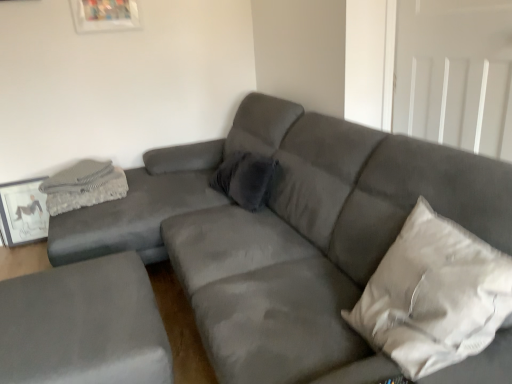
Question: Can velvet gray pillow at center, which is the second pillow in right-to-left order, be found inside white fabric pillow at right, the first pillow when ordered from right to left?

Choices:
 (A) no
 (B) yes

Answer: (A)

Question: Is white fabric pillow at right, the 1th pillow from the front, positioned in front of velvet gray pillow at center, the first pillow from the left?

Choices:
 (A) yes
 (B) no

Answer: (A)

Question: Does white fabric pillow at right, the second pillow positioned from the back, have a lesser width compared to velvet gray pillow at center, positioned as the second pillow in front-to-back order?

Choices:
 (A) no
 (B) yes

Answer: (A)

Question: Is white fabric pillow at right, the second pillow positioned from the back, positioned far away from velvet gray pillow at center, the first pillow from the left?

Choices:
 (A) yes
 (B) no

Answer: (A)

Question: Is white fabric pillow at right, the 1th pillow from the front, to the left of velvet gray pillow at center, which is the second pillow in right-to-left order, from the viewer's perspective?

Choices:
 (A) no
 (B) yes

Answer: (A)

Question: From the image's perspective, is white fabric pillow at right, the first pillow when ordered from right to left, on top of velvet gray pillow at center, the first pillow in the back-to-front sequence?

Choices:
 (A) no
 (B) yes

Answer: (A)

Question: Considering the relative sizes of gray textured blanket at upper left and matte gray picture frame at left in the image provided, is gray textured blanket at upper left wider than matte gray picture frame at left?

Choices:
 (A) no
 (B) yes

Answer: (B)

Question: Is gray textured blanket at upper left oriented away from matte gray picture frame at left?

Choices:
 (A) no
 (B) yes

Answer: (A)

Question: Considering the relative sizes of gray textured blanket at upper left and matte gray picture frame at left in the image provided, is gray textured blanket at upper left bigger than matte gray picture frame at left?

Choices:
 (A) no
 (B) yes

Answer: (B)

Question: Considering the relative sizes of gray textured blanket at upper left and matte gray picture frame at left in the image provided, is gray textured blanket at upper left thinner than matte gray picture frame at left?

Choices:
 (A) no
 (B) yes

Answer: (A)

Question: Is the depth of gray textured blanket at upper left less than that of matte gray picture frame at left?

Choices:
 (A) no
 (B) yes

Answer: (B)

Question: Does gray textured blanket at upper left contain matte gray picture frame at left?

Choices:
 (A) no
 (B) yes

Answer: (A)

Question: Is suede gray ottoman at lower left, the 1th studio couch viewed from the left, thinner than matte gray picture frame at left?

Choices:
 (A) yes
 (B) no

Answer: (B)